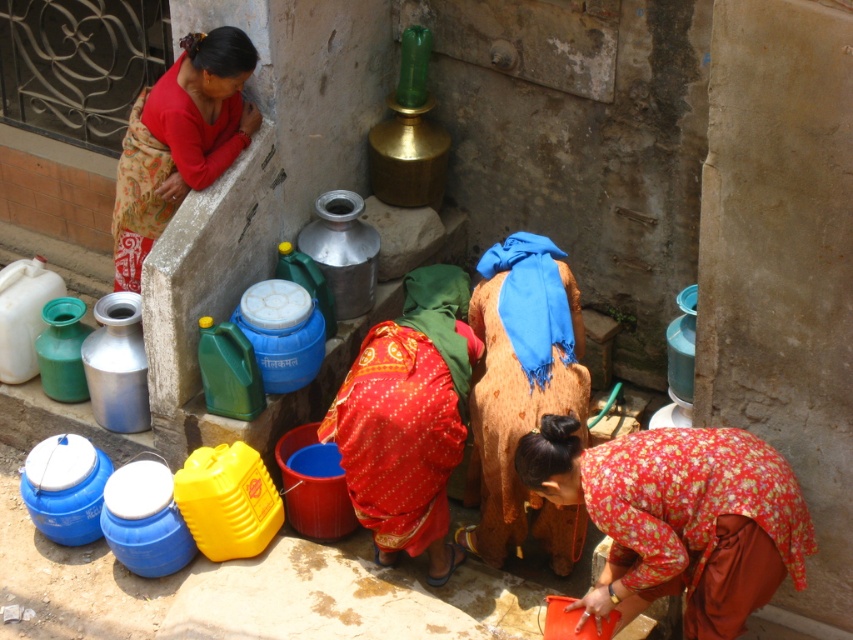
You are standing at the position of point (125, 157) and want to walk to the water source located at point (758, 468). Which direction should you move in to reach it?

You should move forward because point (758, 468) is in front of point (125, 157).

You are a photographer standing at the edge of the scene. You want to capture a photo that includes both the floral fabric dress at lower center and the red floral dress at center. Given their distance apart, will you need to zoom in or zoom out to include both in the frame?

The floral fabric dress at lower center and red floral dress at center are 3.40 feet apart from each other. To include both in the frame, you would need to zoom out to widen the field of view so that both dresses can fit within the camera frame.

You are a photographer trying to capture the scene of the women collecting water. You notice the floral fabric dress at lower center is at a specific coordinate. To ensure the dress is in the center of your photo, should you move the camera to the left or right?

The floral fabric dress at lower center is located at coordinate point (677, 516). Since the x coordinate 0.809 is closer to the right side of the image, moving the camera slightly to the right would center the dress in the photo.